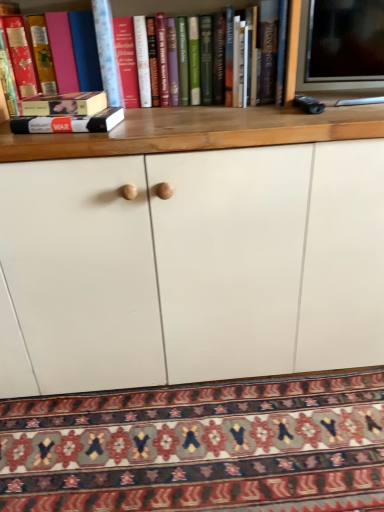
Locate an element on the screen. This screenshot has width=384, height=512. vacant area located to the right-hand side of hardcover book at left, marked as the first book in a bottom-to-top arrangement is located at coordinates (163, 123).